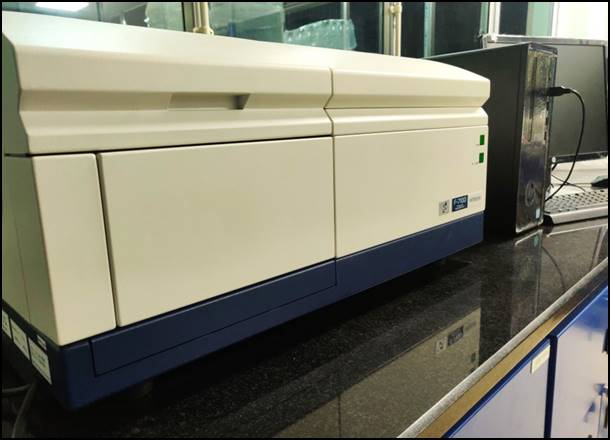
Locate an element on the screen. Image resolution: width=610 pixels, height=440 pixels. mouse is located at coordinates (598, 182).